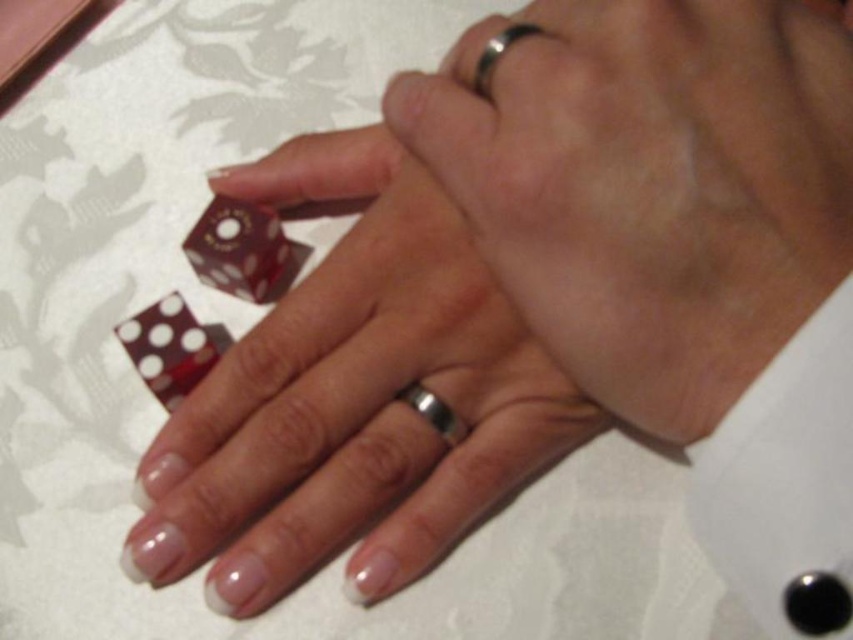
Can you confirm if silver metallic ring at center is taller than matte plastic dice at center?

No, silver metallic ring at center is not taller than matte plastic dice at center.

Can you confirm if silver metallic ring at center is wider than matte plastic dice at center?

Incorrect, silver metallic ring at center's width does not surpass matte plastic dice at center's.

Find the location of a particular element. silver metallic ring at center is located at coordinates (650, 188).

Identify the location of silver metallic ring at center. (650, 188).

Where is `matte plastic dice at center`? The width and height of the screenshot is (853, 640). matte plastic dice at center is located at coordinates (352, 397).

Does matte plastic dice at center appear on the left side of silver/metallic ring at upper center?

Indeed, matte plastic dice at center is positioned on the left side of silver/metallic ring at upper center.

Which is behind, point (397, 522) or point (485, 60)?

The point (397, 522) is more distant.

The width and height of the screenshot is (853, 640). I want to click on matte plastic dice at center, so click(352, 397).

Is silver metallic ring at center in front of silver/metallic ring at center?

Yes, silver metallic ring at center is closer to the viewer.

Who is more distant from viewer, (546, 275) or (432, 396)?

Point (432, 396)

Where is `silver metallic ring at center`? The width and height of the screenshot is (853, 640). silver metallic ring at center is located at coordinates (650, 188).